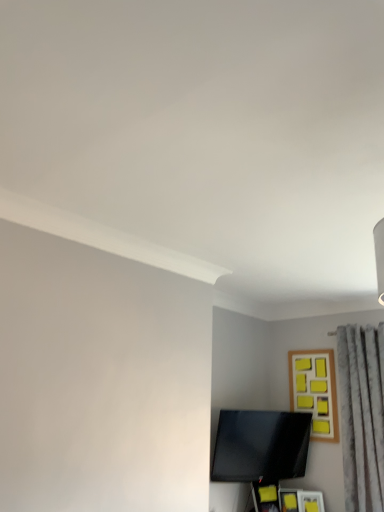
Question: Is gray textured curtain at right inside or outside of wooden frame with yellow sticky notes at upper right?

Choices:
 (A) outside
 (B) inside

Answer: (A)

Question: Considering the positions of gray textured curtain at right and wooden frame with yellow sticky notes at upper right in the image, is gray textured curtain at right wider or thinner than wooden frame with yellow sticky notes at upper right?

Choices:
 (A) wide
 (B) thin

Answer: (A)

Question: Considering the real-world distances, which object is closest to the gray textured curtain at right?

Choices:
 (A) wooden frame with yellow sticky notes at upper right
 (B) black glossy tv at lower center

Answer: (A)

Question: Estimate the real-world distances between objects in this image. Which object is closer to the gray textured curtain at right?

Choices:
 (A) wooden frame with yellow sticky notes at upper right
 (B) black glossy tv at lower center

Answer: (A)